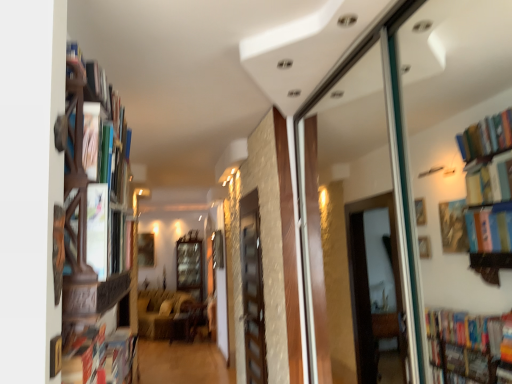
Image resolution: width=512 pixels, height=384 pixels. I want to click on wooden screen door at center, so click(x=253, y=299).

In order to click on velvet beige sofa at center in this screenshot , I will do `click(159, 312)`.

At what (x,y) coordinates should I click in order to perform the action: click on wooden cabinet at center. Please return your answer as a coordinate pair (x, y). This screenshot has width=512, height=384. Looking at the image, I should click on (190, 263).

Is point (70, 112) farther from viewer compared to point (264, 370)?

That is False.

In the image, is wooden bookshelf at left positioned in front of or behind wooden screen door at center?

Clearly, wooden bookshelf at left is in front of wooden screen door at center.

Looking at this image, is wooden bookshelf at left far from wooden screen door at center?

Yes, wooden bookshelf at left is far from wooden screen door at center.

Consider the image. In the image, is wooden bookshelf at left on the left side or the right side of wooden screen door at center?

From the image, it's evident that wooden bookshelf at left is to the left of wooden screen door at center.

Considering the relative positions of wooden cabinet at center and wooden bookshelf at left in the image provided, is wooden cabinet at center behind wooden bookshelf at left?

Yes.

From the picture: Is wooden cabinet at center turned away from wooden bookshelf at left?

No, wooden cabinet at center is not facing away from wooden bookshelf at left.

Are wooden cabinet at center and wooden bookshelf at left making contact?

No, wooden cabinet at center is not touching wooden bookshelf at left.

Locate an element on the screen. This screenshot has width=512, height=384. bookcase on the right of wooden cabinet at center is located at coordinates (94, 203).

Is wooden cabinet at center positioned behind wooden screen door at center?

Yes, it is behind wooden screen door at center.

In the image, is wooden cabinet at center on the left side or the right side of wooden screen door at center?

wooden cabinet at center is to the left of wooden screen door at center.

Choose the correct answer: Is wooden cabinet at center inside wooden screen door at center or outside it?

wooden cabinet at center is not enclosed by wooden screen door at center.

From a real-world perspective, is wooden cabinet at center positioned above or below wooden screen door at center?

wooden cabinet at center is below wooden screen door at center.

From the image's perspective, who appears lower, wooden cabinet at center or velvet beige sofa at center?

From the image's view, velvet beige sofa at center is below.

Which is behind, point (201, 294) or point (143, 306)?

The point (201, 294) is farther.

Is wooden cabinet at center not inside velvet beige sofa at center?

Yes, wooden cabinet at center is outside of velvet beige sofa at center.

Looking at this image, considering the sizes of wooden cabinet at center and velvet beige sofa at center in the image, is wooden cabinet at center taller or shorter than velvet beige sofa at center?

Clearly, wooden cabinet at center is taller compared to velvet beige sofa at center.

Consider the image. Which of these two, velvet beige sofa at center or wooden bookshelf at left, is bigger?

Bigger between the two is velvet beige sofa at center.

Considering the sizes of objects velvet beige sofa at center and wooden bookshelf at left in the image provided, who is taller, velvet beige sofa at center or wooden bookshelf at left?

velvet beige sofa at center.

Could you tell me if velvet beige sofa at center is turned towards wooden bookshelf at left?

Yes, velvet beige sofa at center is turned towards wooden bookshelf at left.

Is velvet beige sofa at center to the right of wooden bookshelf at left from the viewer's perspective?

No.

Considering the relative sizes of velvet beige sofa at center and wooden cabinet at center in the image provided, is velvet beige sofa at center taller than wooden cabinet at center?

No.

Is there a large distance between velvet beige sofa at center and wooden cabinet at center?

velvet beige sofa at center is near wooden cabinet at center, not far away.

From the image's perspective, between velvet beige sofa at center and wooden cabinet at center, which one is located above?

wooden cabinet at center appears higher in the image.

Which object is positioned more to the right, velvet beige sofa at center or wooden cabinet at center?

wooden cabinet at center is more to the right.

Does wooden screen door at center have a lesser height compared to velvet beige sofa at center?

No.

Does point (253, 223) come in front of point (174, 297)?

Yes, point (253, 223) is closer to viewer.

Is wooden screen door at center at the left side of velvet beige sofa at center?

No.

From the image's perspective, between wooden screen door at center and velvet beige sofa at center, which one is located above?

wooden screen door at center, from the image's perspective.

Find the location of a particular element. screen door that is under the wooden bookshelf at left (from a real-world perspective) is located at coordinates (253, 299).

The image size is (512, 384). What are the coordinates of `bookcase on the right of wooden cabinet at center` in the screenshot? It's located at (94, 203).

Estimate the real-world distances between objects in this image. Which object is further from wooden cabinet at center, wooden bookshelf at left or wooden screen door at center?

wooden bookshelf at left lies further to wooden cabinet at center than the other object.

Considering their positions, is wooden cabinet at center positioned closer to velvet beige sofa at center than wooden screen door at center?

wooden cabinet at center.

Looking at the image, which one is located closer to wooden cabinet at center, wooden screen door at center or wooden bookshelf at left?

wooden screen door at center is closer to wooden cabinet at center.

Considering their positions, is wooden screen door at center positioned further to velvet beige sofa at center than wooden cabinet at center?

wooden screen door at center is further to velvet beige sofa at center.

Based on their spatial positions, is wooden cabinet at center or velvet beige sofa at center closer to wooden bookshelf at left?

Among the two, velvet beige sofa at center is located nearer to wooden bookshelf at left.

When comparing their distances from wooden screen door at center, does wooden cabinet at center or velvet beige sofa at center seem further?

wooden cabinet at center lies further to wooden screen door at center than the other object.

Looking at the image, which one is located further to wooden screen door at center, wooden cabinet at center or wooden bookshelf at left?

The object further to wooden screen door at center is wooden cabinet at center.

When comparing their distances from wooden bookshelf at left, does wooden screen door at center or velvet beige sofa at center seem closer?

wooden screen door at center.

Find the location of a particular element. The width and height of the screenshot is (512, 384). furniture located between wooden screen door at center and wooden cabinet at center in the depth direction is located at coordinates (159, 312).

The height and width of the screenshot is (384, 512). Identify the location of screen door located between wooden bookshelf at left and wooden cabinet at center in the depth direction. (253, 299).

Locate an element on the screen. The width and height of the screenshot is (512, 384). furniture positioned between wooden bookshelf at left and wooden cabinet at center from near to far is located at coordinates (159, 312).

Locate an element on the screen. This screenshot has height=384, width=512. screen door positioned between wooden bookshelf at left and velvet beige sofa at center from near to far is located at coordinates (253, 299).